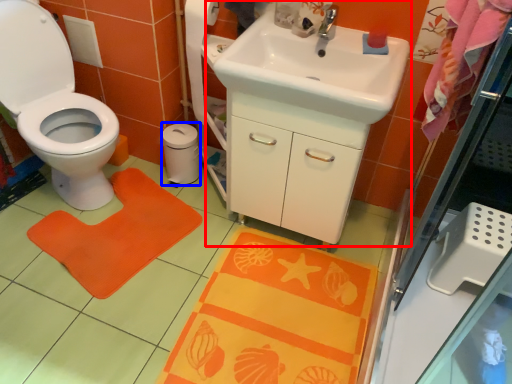
Question: Which object is closer to the camera taking this photo, sink (highlighted by a red box) or toilet paper (highlighted by a blue box)?

Choices:
 (A) sink
 (B) toilet paper

Answer: (A)